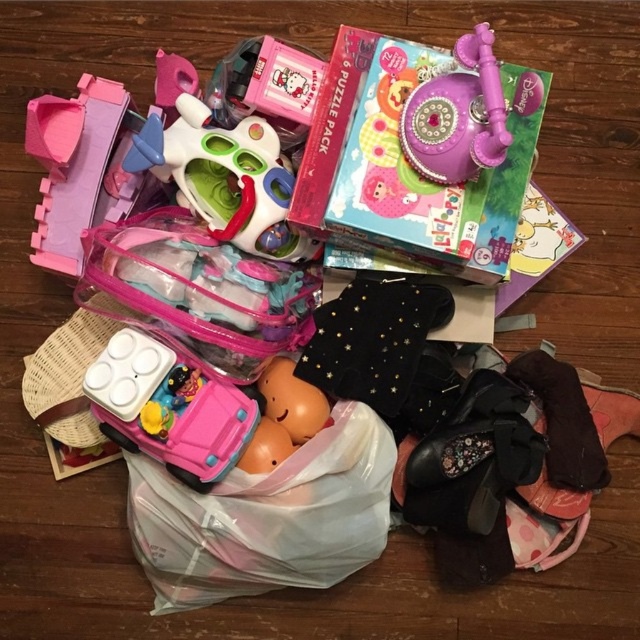
Between translucent plastic bag at center and translucent plastic toy car at center, which one appears on the left side from the viewer's perspective?

translucent plastic toy car at center is more to the left.

Describe the element at coordinates (266, 516) in the screenshot. This screenshot has width=640, height=640. I see `translucent plastic bag at center` at that location.

Does point (163, 490) come farther from viewer compared to point (131, 355)?

That is True.

The height and width of the screenshot is (640, 640). Identify the location of translucent plastic bag at center. (266, 516).

Is translucent plastic bag at center positioned before smooth orange plush at center?

Yes, translucent plastic bag at center is in front of smooth orange plush at center.

Which is below, translucent plastic bag at center or smooth orange plush at center?

Positioned lower is translucent plastic bag at center.

What do you see at coordinates (266, 516) in the screenshot?
I see `translucent plastic bag at center` at bounding box center [266, 516].

You are a GUI agent. You are given a task and a screenshot of the screen. Output one action in this format:
    pyautogui.click(x=<x>, y=<y>)
    Task: Click on the translucent plastic bag at center
    The image size is (640, 640).
    Given the screenshot: What is the action you would take?
    pyautogui.click(x=266, y=516)

Between translucent plastic bag at center and translucent plastic toy at center, which one appears on the right side from the viewer's perspective?

translucent plastic bag at center

Does translucent plastic bag at center lie behind translucent plastic toy at center?

That is True.

Between point (156, 572) and point (272, 244), which one is positioned behind?

The point (156, 572) is behind.

This screenshot has height=640, width=640. I want to click on translucent plastic bag at center, so click(x=266, y=516).